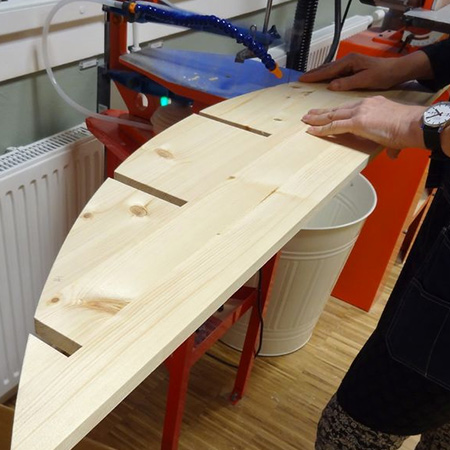
In order to click on windowframe in this screenshot , I will do `click(31, 23)`, `click(203, 7)`, `click(150, 28)`.